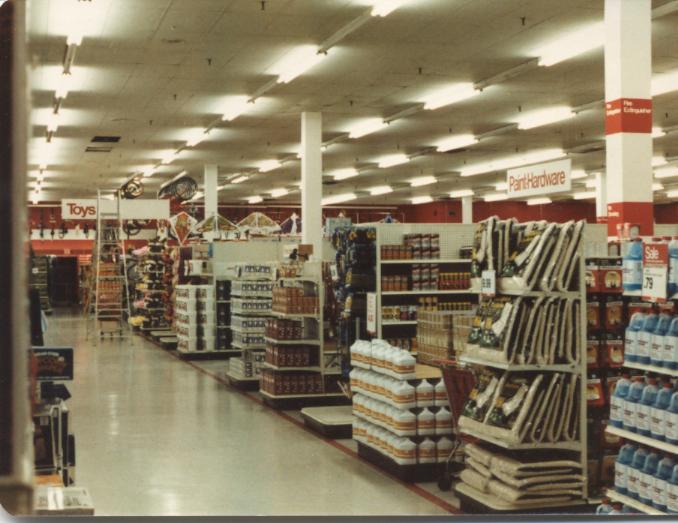
Locate an element on the screen. ceiling is located at coordinates (163, 86).